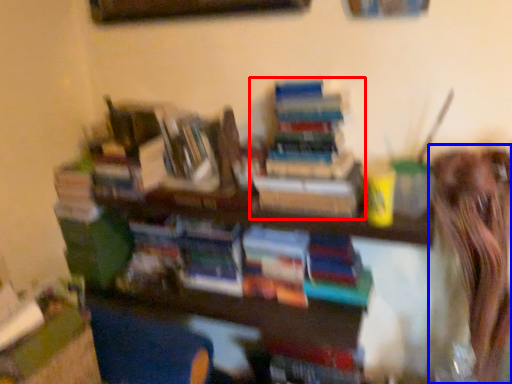
Question: Which point is further to the camera, book (highlighted by a red box) or person (highlighted by a blue box)?

Choices:
 (A) book
 (B) person

Answer: (A)